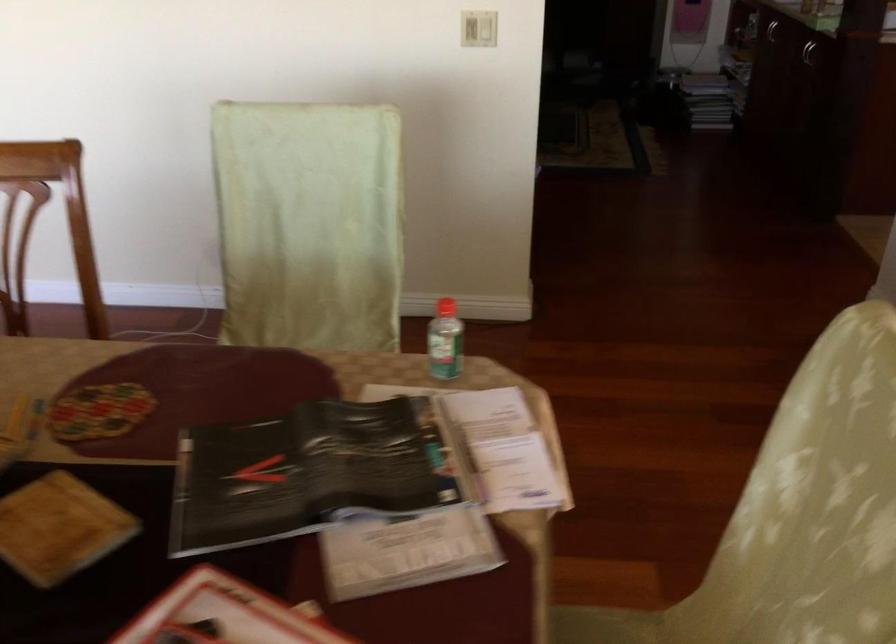
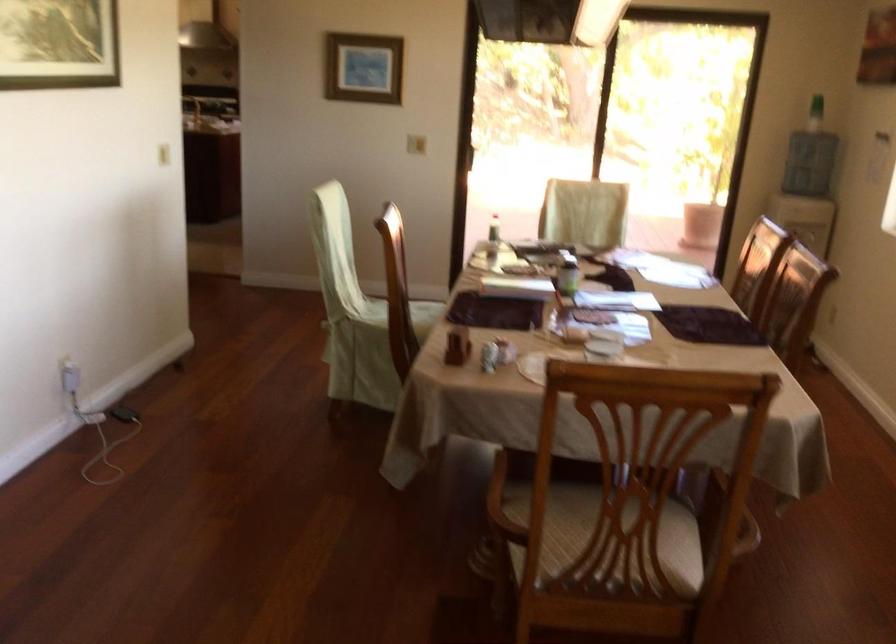
Locate, in the second image, the point that corresponds to (196,292) in the first image.

(97, 424)